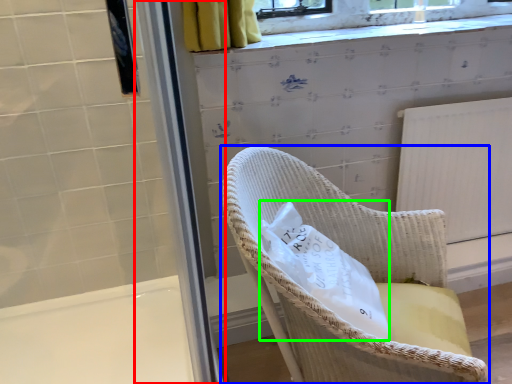
Question: Considering the real-world distances, which object is farthest from screen door (highlighted by a red box)? chair (highlighted by a blue box) or material (highlighted by a green box)?

Choices:
 (A) chair
 (B) material

Answer: (A)